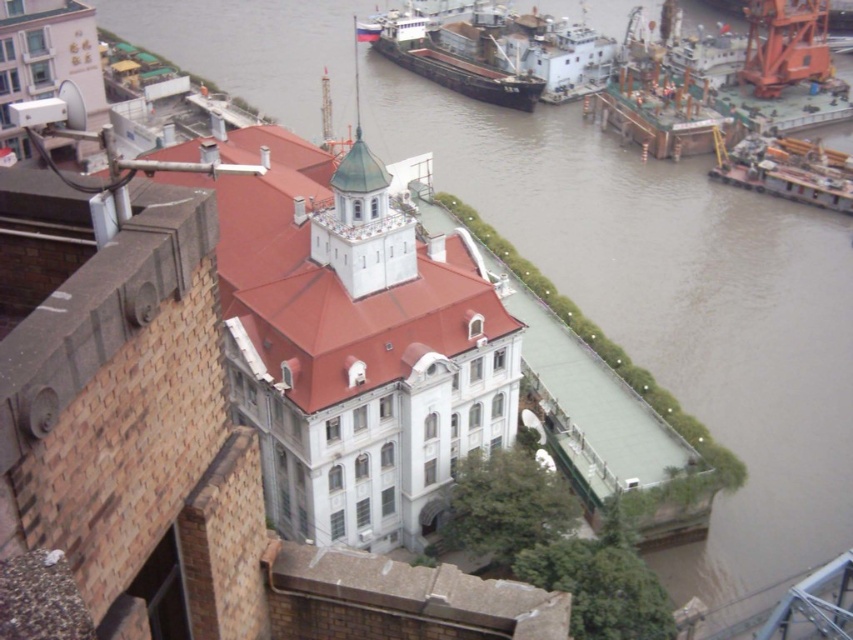
Who is shorter, brown matte cargo ship at upper right or metallic gray barge at right?

Standing shorter between the two is metallic gray barge at right.

Is brown matte cargo ship at upper right further to the viewer compared to metallic gray barge at right?

Yes.

What do you see at coordinates (492, 51) in the screenshot? This screenshot has width=853, height=640. I see `brown matte cargo ship at upper right` at bounding box center [492, 51].

You are a GUI agent. You are given a task and a screenshot of the screen. Output one action in this format:
    pyautogui.click(x=<x>, y=<y>)
    Task: Click on the brown matte cargo ship at upper right
    The height and width of the screenshot is (640, 853).
    Given the screenshot: What is the action you would take?
    pyautogui.click(x=492, y=51)